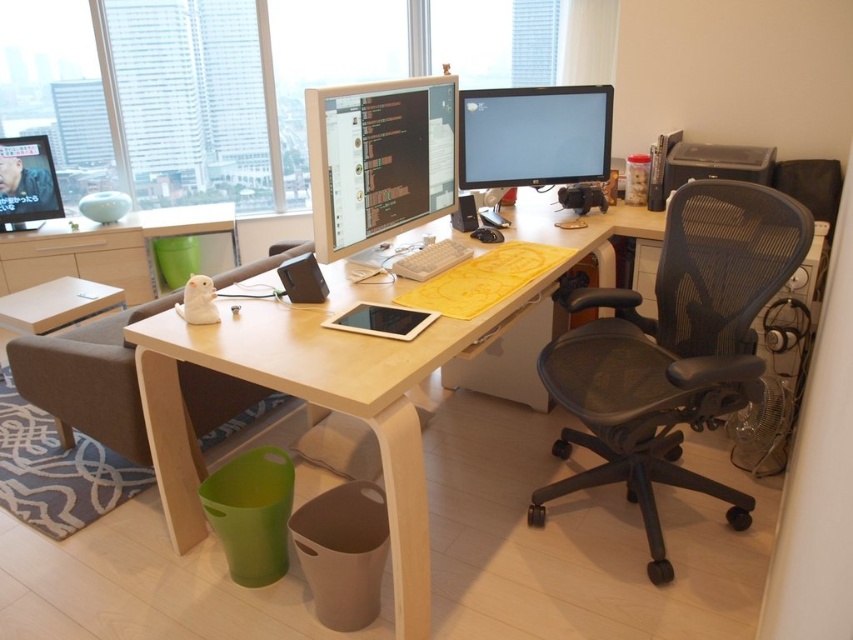
Question: From the image, what is the correct spatial relationship of black mesh office chair at right in relation to black mesh swivel chair at lower center?

Choices:
 (A) right
 (B) left

Answer: (A)

Question: Which object is closer to the camera taking this photo?

Choices:
 (A) matte black monitor at center
 (B) black mesh swivel chair at lower center
 (C) matte black monitor at upper right

Answer: (A)

Question: Which point is farther to the camera?

Choices:
 (A) (482, 125)
 (B) (607, 440)

Answer: (A)

Question: Can you confirm if matte black monitor at center is positioned below matte black monitor at upper left?

Choices:
 (A) yes
 (B) no

Answer: (A)

Question: Is matte black monitor at center thinner than matte black monitor at upper left?

Choices:
 (A) yes
 (B) no

Answer: (B)

Question: Which point is farther to the camera?

Choices:
 (A) (665, 212)
 (B) (27, 180)

Answer: (B)